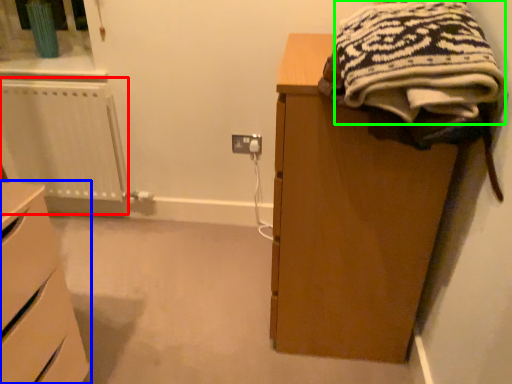
Question: Which is nearer to the radiator (highlighted by a red box)? chest of drawers (highlighted by a blue box) or clothing (highlighted by a green box).

Choices:
 (A) chest of drawers
 (B) clothing

Answer: (A)